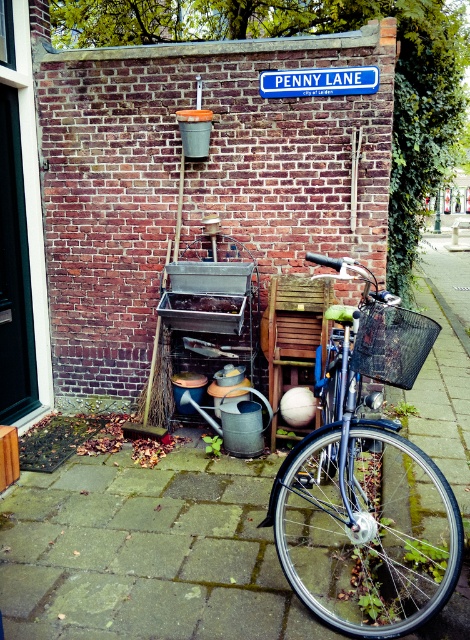
Question: Is smooth concrete pavement at lower center positioned behind black woven basket at center?

Choices:
 (A) no
 (B) yes

Answer: (A)

Question: Can you confirm if smooth concrete pavement at lower center is positioned below blue plastic street sign at upper center?

Choices:
 (A) no
 (B) yes

Answer: (B)

Question: Among these points, which one is farthest from the camera?

Choices:
 (A) (399, 625)
 (B) (410, 371)
 (C) (297, 76)
 (D) (437, 490)

Answer: (C)

Question: Which point is closer to the camera taking this photo?

Choices:
 (A) (413, 595)
 (B) (291, 96)

Answer: (A)

Question: Does black woven basket at center have a larger size compared to blue plastic street sign at upper center?

Choices:
 (A) yes
 (B) no

Answer: (A)

Question: Which point is farther to the camera?

Choices:
 (A) smooth concrete pavement at lower center
 (B) blue plastic street sign at upper center
 (C) black woven basket at center
 (D) shiny metallic bicycle at center

Answer: (B)